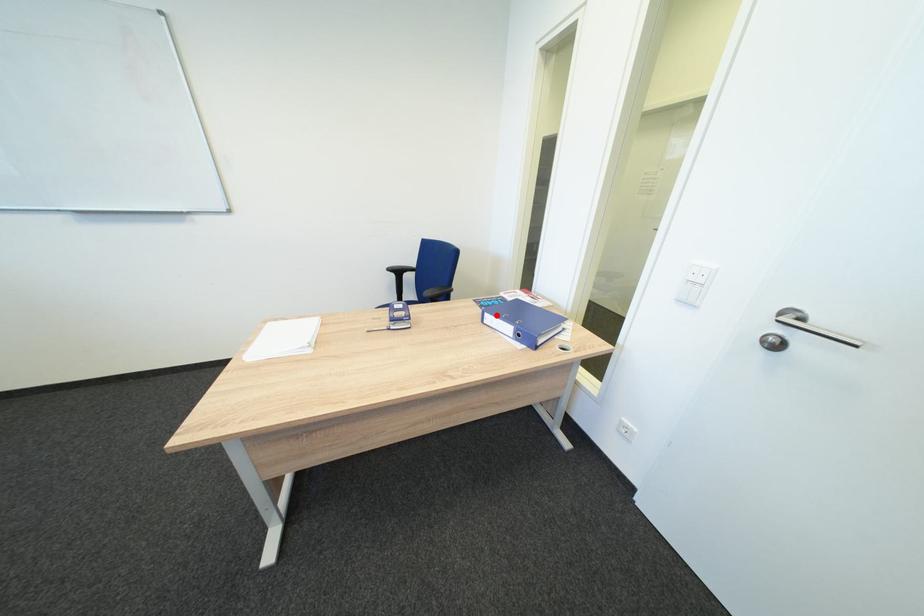
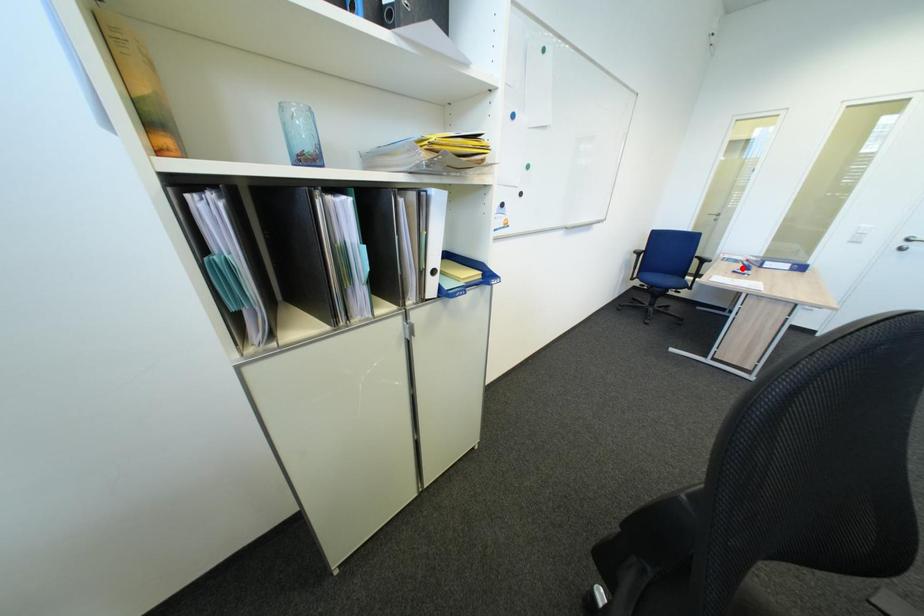
I am providing you with two images of the same scene from different viewpoints. A red point is marked on the first image and another point is marked on the second image. Is the red point in image1 aligned with the point shown in image2?

No